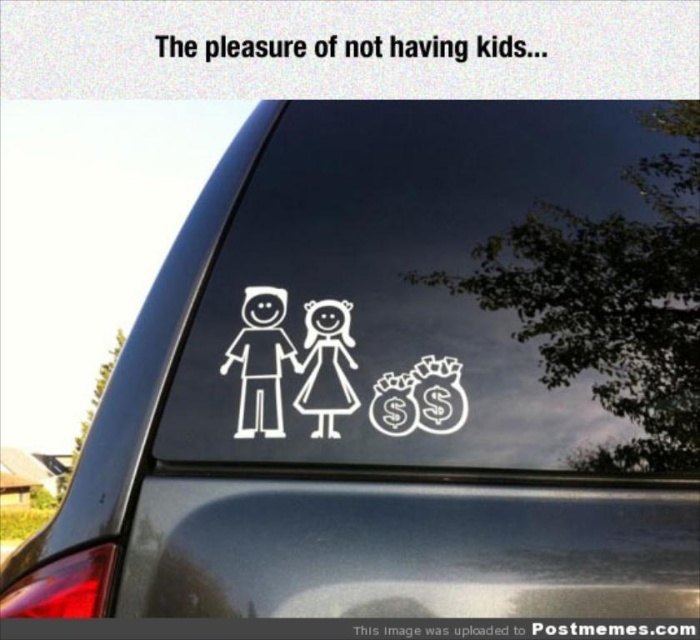
You are a car enthusiast who wants to install a new decal on your sedan. You have two options from the image provided. Which object from the image is wider, the transparent vinyl sticker at center or the white matte figure at center?

The transparent vinyl sticker at center is wider than the white matte figure at center according to the description.

You are a car enthusiast who wants to install a new sticker on your car window. You have two items to place there, a transparent vinyl sticker at center and white glossy money bags at center. According to the scene, which object should be placed to the left of the other?

The transparent vinyl sticker at center should be placed to the left of the white glossy money bags at center because the transparent vinyl sticker at center is positioned on the left side of white glossy money bags at center in the scene.

From the picture: You are a graphic designer who needs to create a new decal for a car. The client wants the transparent vinyl sticker at center to be proportionally sized compared to the white glossy money bags at center. Based on the existing image, which object should be made larger to maintain the correct proportion?

The transparent vinyl sticker at center should be made larger than the white glossy money bags at center to maintain the correct proportion, as the existing image shows the transparent vinyl sticker at center is wider than the white glossy money bags at center.